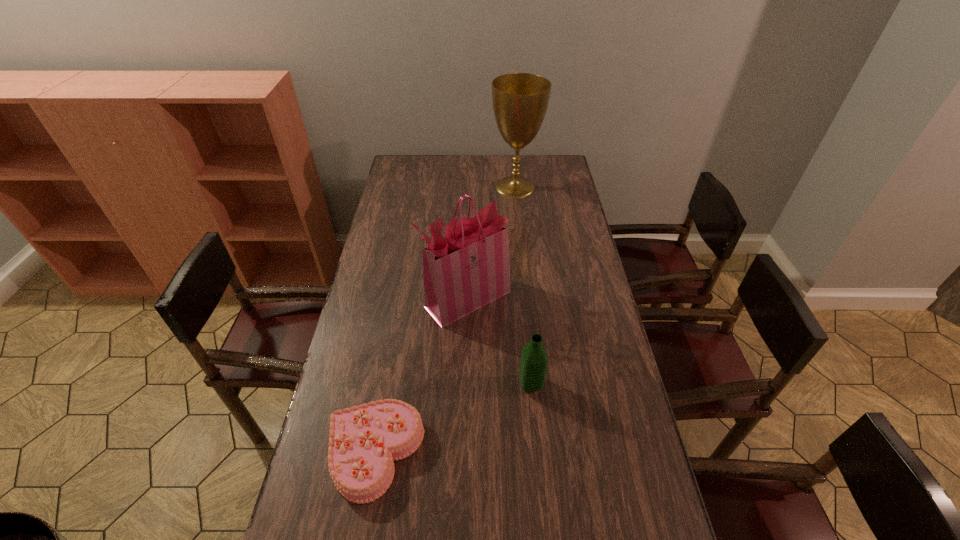
This screenshot has width=960, height=540. Identify the location of free space between the shortest object and the second farthest object. coord(421,376).

Image resolution: width=960 pixels, height=540 pixels. What are the coordinates of `free point between the nearest object and the third nearest object` in the screenshot? It's located at (421, 376).

Select which object is the third closest to the third nearest object. Please provide its 2D coordinates. Your answer should be formatted as a tuple, i.e. [(x, y)], where the tuple contains the x and y coordinates of a point satisfying the conditions above.

[(520, 100)]

Select which object is the second closest to the farthest object. Please provide its 2D coordinates. Your answer should be formatted as a tuple, i.e. [(x, y)], where the tuple contains the x and y coordinates of a point satisfying the conditions above.

[(534, 360)]

Locate an element on the screen. free spot that satisfies the following two spatial constraints: 1. on the back side of the farthest object; 2. on the right side of the third tallest object is located at coordinates (512, 187).

Where is `free spot that satisfies the following two spatial constraints: 1. on the back side of the cake; 2. on the left side of the water bottle`? The width and height of the screenshot is (960, 540). free spot that satisfies the following two spatial constraints: 1. on the back side of the cake; 2. on the left side of the water bottle is located at coordinates (387, 384).

Locate an element on the screen. Image resolution: width=960 pixels, height=540 pixels. vacant space that satisfies the following two spatial constraints: 1. on the front side of the water bottle; 2. on the left side of the shopping bag is located at coordinates (465, 384).